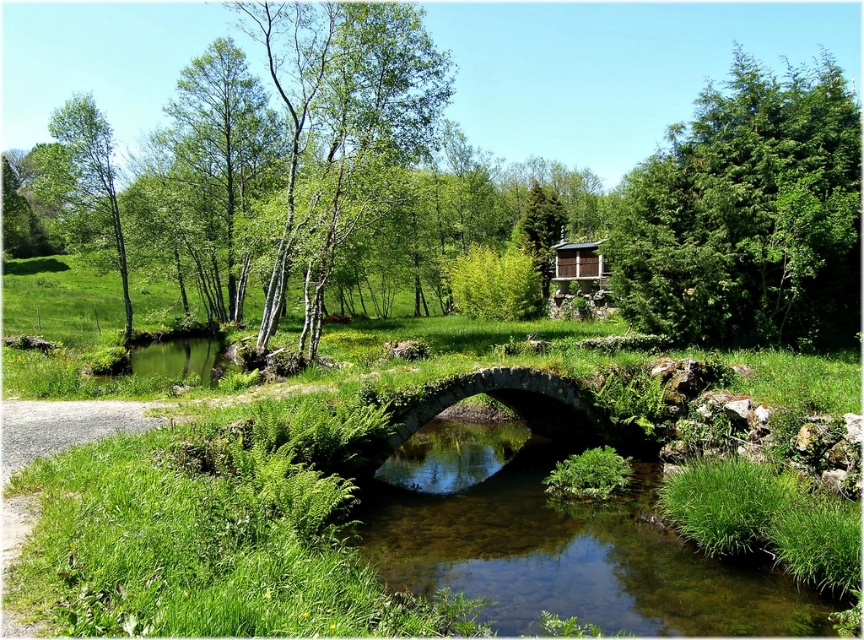
Does green leafy tree at left have a smaller size compared to wooden cabin at upper center?

Incorrect, green leafy tree at left is not smaller in size than wooden cabin at upper center.

Based on the photo, does green leafy tree at left have a greater width compared to wooden cabin at upper center?

Yes, green leafy tree at left is wider than wooden cabin at upper center.

Where is `green leafy tree at left`? This screenshot has height=640, width=864. green leafy tree at left is located at coordinates (93, 170).

At what (x,y) coordinates should I click in order to perform the action: click on green leafy tree at left. Please return your answer as a coordinate pair (x, y). Looking at the image, I should click on (93, 170).

Which is in front, point (766, 296) or point (595, 264)?

Point (766, 296) is in front.

Which of these two, green leafy tree at upper right or wooden cabin at upper center, stands taller?

Standing taller between the two is green leafy tree at upper right.

Who is more forward, (802, 157) or (601, 260)?

Point (802, 157) is in front.

Find the location of `green leafy tree at upper right`. green leafy tree at upper right is located at coordinates (747, 216).

Does green leafy tree at upper right have a lesser width compared to green leafy tree at left?

No, green leafy tree at upper right is not thinner than green leafy tree at left.

Which is below, green leafy tree at upper right or green leafy tree at left?

Positioned lower is green leafy tree at left.

Where is `green leafy tree at upper right`? The width and height of the screenshot is (864, 640). green leafy tree at upper right is located at coordinates (747, 216).

Find the location of `green leafy tree at upper right`. green leafy tree at upper right is located at coordinates (747, 216).